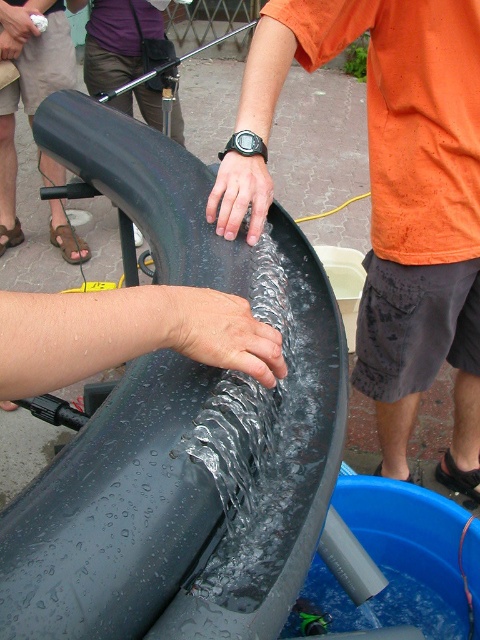
You are standing in front of the experiment setup. There is a point marked at coordinates (400, 196). Which object from the scene is located at this point?

The point at coordinates (400, 196) marks the orange fabric shirt at center.

You are a scientist observing the experiment setup. You need to determine if the orange fabric shirt at center can completely cover the glossy metallic hand at center without overlapping. Can it?

The orange fabric shirt at center might be wider than glossy metallic hand at center, so it could potentially cover it without overlapping, but there is uncertainty due to the comparative size.